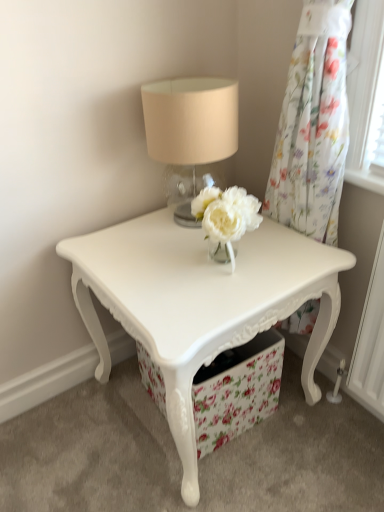
The width and height of the screenshot is (384, 512). I want to click on blank space situated above white glossy table at center (from a real-world perspective), so click(180, 249).